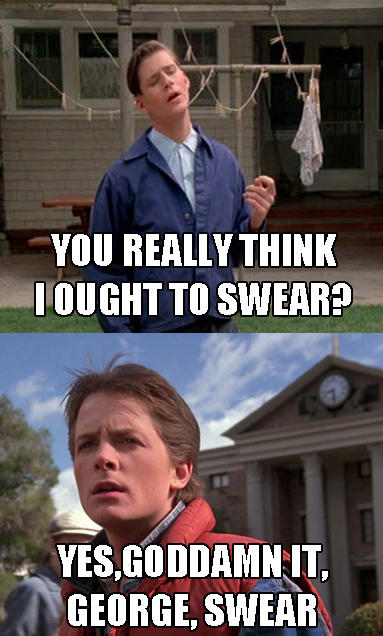
You are a GUI agent. You are given a task and a screenshot of the screen. Output one action in this format:
    pyautogui.click(x=<x>, y=<y>)
    Task: Click on the columns
    
    Given the screenshot: What is the action you would take?
    pyautogui.click(x=255, y=505), pyautogui.click(x=317, y=502), pyautogui.click(x=376, y=481), pyautogui.click(x=338, y=519)